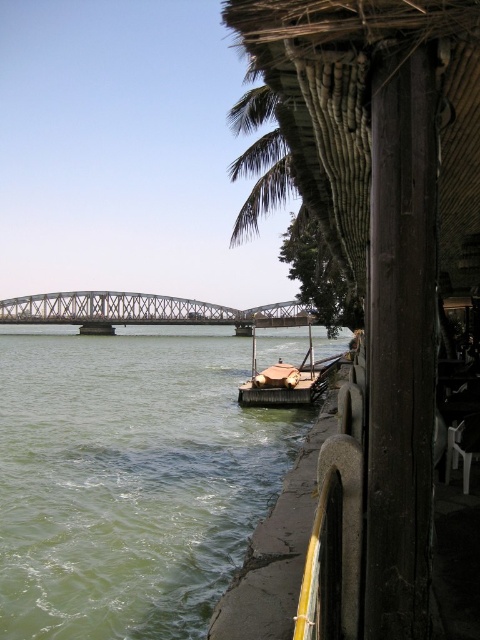
Question: Estimate the real-world distances between objects in this image. Which object is closer to the thatched straw hut at right?

Choices:
 (A) gray metallic bridge at center
 (B) wooden boat at center
 (C) green water at center

Answer: (B)

Question: Is green water at center positioned behind gray metallic bridge at center?

Choices:
 (A) yes
 (B) no

Answer: (B)

Question: Considering the relative positions of green water at center and wooden boat at center in the image provided, where is green water at center located with respect to wooden boat at center?

Choices:
 (A) below
 (B) above

Answer: (A)

Question: Considering the real-world distances, which object is closest to the thatched straw hut at right?

Choices:
 (A) gray metallic bridge at center
 (B) green water at center

Answer: (B)

Question: Does thatched straw hut at right appear over green water at center?

Choices:
 (A) yes
 (B) no

Answer: (A)

Question: Which point appears closest to the camera in this image?

Choices:
 (A) (405, 456)
 (B) (78, 612)
 (C) (276, 371)
 (D) (86, 296)

Answer: (A)